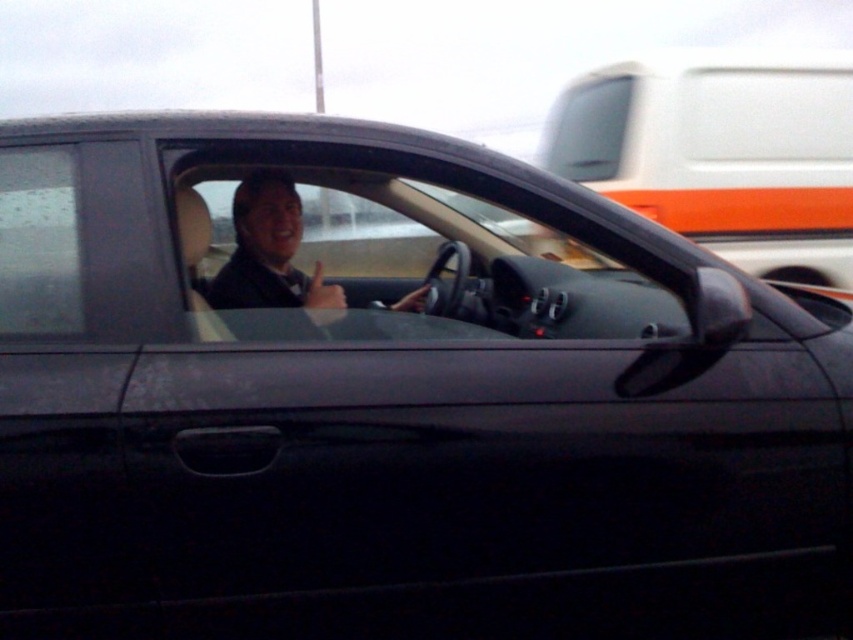
You are a delivery person trying to hand a package to the driver through the open driver side window. The package is 18 inches tall. Can you fit the package through the transparent glass window at center without bending it, considering the size of the matte black suit at center?

The transparent glass window at center is taller than the matte black suit at center, so the package can fit through the window as long as its height does not exceed the window height. Since the package is 18 inches tall and the window is taller than the suit, it should fit unless the suit itself is taller than 18 inches. However, without specific measurements, we can infer the window is sufficiently tall for the package.